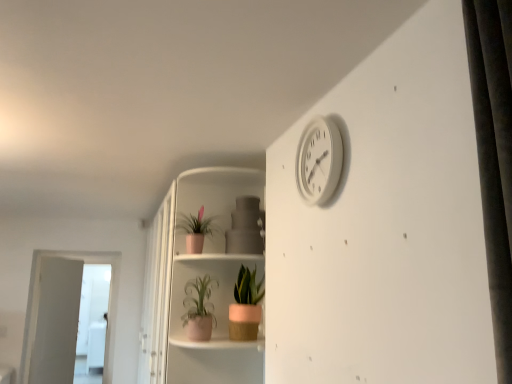
What do you see at coordinates (92, 323) in the screenshot? The image size is (512, 384). I see `white glossy screen door at lower left, the second screen door positioned from the front` at bounding box center [92, 323].

The height and width of the screenshot is (384, 512). What do you see at coordinates (39, 308) in the screenshot?
I see `white glossy screen door at left, the second screen door when ordered from back to front` at bounding box center [39, 308].

The height and width of the screenshot is (384, 512). What do you see at coordinates (246, 306) in the screenshot?
I see `pink matte pot at lower center, placed as the third houseplant when sorted from left to right` at bounding box center [246, 306].

The height and width of the screenshot is (384, 512). I want to click on matte white shelf at center, so click(x=212, y=241).

You are a GUI agent. You are given a task and a screenshot of the screen. Output one action in this format:
    pyautogui.click(x=<x>, y=<y>)
    Task: Click on the white glossy screen door at lower left, the first screen door from the left
    
    Given the screenshot: What is the action you would take?
    pyautogui.click(x=92, y=323)

From a real-world perspective, which is physically above, pink matte pot at upper center, which is the 3th houseplant in right-to-left order, or white glossy screen door at lower left, the second screen door positioned from the front?

In real-world perspective, pink matte pot at upper center, which is the 3th houseplant in right-to-left order, is above.

Consider the image. Is pink matte pot at upper center, which is the 3th houseplant in right-to-left order, bigger than white glossy screen door at lower left, the second screen door positioned from the front?

No.

Which of these two, pink matte pot at upper center, acting as the 1th houseplant starting from the left, or white glossy screen door at lower left, the second screen door positioned from the front, is thinner?

white glossy screen door at lower left, the second screen door positioned from the front, is thinner.

Is pink matte pot at upper center, which is the 3th houseplant in right-to-left order, facing towards white glossy screen door at lower left, the first screen door from the left?

No, pink matte pot at upper center, which is the 3th houseplant in right-to-left order, is not aimed at white glossy screen door at lower left, the first screen door from the left.

Is white glossy screen door at lower left, the second screen door positioned from the front, bigger than pink matte pot at lower center, positioned as the first houseplant in right-to-left order?

Indeed, white glossy screen door at lower left, the second screen door positioned from the front, has a larger size compared to pink matte pot at lower center, positioned as the first houseplant in right-to-left order.

From a real-world perspective, is white glossy screen door at lower left, placed as the 2th screen door when sorted from right to left, located higher than pink matte pot at lower center, placed as the third houseplant when sorted from left to right?

No, from a real-world perspective, white glossy screen door at lower left, placed as the 2th screen door when sorted from right to left, is not on top of pink matte pot at lower center, placed as the third houseplant when sorted from left to right.

Does white glossy screen door at lower left, positioned as the first screen door in back-to-front order, appear on the right side of pink matte pot at lower center, positioned as the first houseplant in right-to-left order?

No, white glossy screen door at lower left, positioned as the first screen door in back-to-front order, is not to the right of pink matte pot at lower center, positioned as the first houseplant in right-to-left order.

Is white glossy screen door at lower left, positioned as the first screen door in back-to-front order, turned away from pink matte pot at lower center, placed as the third houseplant when sorted from left to right?

No, white glossy screen door at lower left, positioned as the first screen door in back-to-front order,'s orientation is not away from pink matte pot at lower center, placed as the third houseplant when sorted from left to right.

Considering the sizes of objects matte white shelf at center and pink matte pot at lower center, placed as the third houseplant when sorted from left to right, in the image provided, who is smaller, matte white shelf at center or pink matte pot at lower center, placed as the third houseplant when sorted from left to right,?

pink matte pot at lower center, placed as the third houseplant when sorted from left to right, is smaller.

Is matte white shelf at center in front of pink matte pot at lower center, placed as the third houseplant when sorted from left to right?

Yes, matte white shelf at center is closer to the viewer.

Find the location of a particular element. Image resolution: width=512 pixels, height=384 pixels. shelf located above the pink matte pot at lower center, positioned as the first houseplant in right-to-left order (from the image's perspective) is located at coordinates (212, 241).

Which point is more forward, (24, 372) or (238, 317)?

The point (238, 317) is closer to the camera.

Is white glossy screen door at left, the second screen door when ordered from back to front, in front of or behind pink matte pot at lower center, positioned as the first houseplant in right-to-left order, in the image?

Visually, white glossy screen door at left, the second screen door when ordered from back to front, is located behind pink matte pot at lower center, positioned as the first houseplant in right-to-left order.

Is white glossy screen door at left, the second screen door when ordered from back to front, aimed at pink matte pot at lower center, positioned as the first houseplant in right-to-left order?

No, white glossy screen door at left, the second screen door when ordered from back to front, is not aimed at pink matte pot at lower center, positioned as the first houseplant in right-to-left order.

Who is taller, white glossy screen door at left, which is counted as the 1th screen door, starting from the right, or pink matte pot at lower center, positioned as the first houseplant in right-to-left order?

With more height is white glossy screen door at left, which is counted as the 1th screen door, starting from the right.

Considering the points (242, 315) and (226, 195), which point is in front, point (242, 315) or point (226, 195)?

The point (242, 315) is closer to the camera.

From a real-world perspective, is pink matte pot at lower center, positioned as the first houseplant in right-to-left order, positioned under matte white shelf at center based on gravity?

Yes, from a real-world perspective, pink matte pot at lower center, positioned as the first houseplant in right-to-left order, is beneath matte white shelf at center.

Measure the distance between pink matte pot at lower center, positioned as the first houseplant in right-to-left order, and matte white shelf at center.

pink matte pot at lower center, positioned as the first houseplant in right-to-left order, is 25.04 centimeters away from matte white shelf at center.

From the image's perspective, is white glossy screen door at lower left, the first screen door from the left, located above pink matte pot at upper center, which is the 3th houseplant in right-to-left order?

Actually, white glossy screen door at lower left, the first screen door from the left, appears below pink matte pot at upper center, which is the 3th houseplant in right-to-left order, in the image.

Considering the positions of point (99, 382) and point (189, 216), is point (99, 382) closer or farther from the camera than point (189, 216)?

Point (99, 382) appears to be farther away from the viewer than point (189, 216).

Can you tell me how much white glossy screen door at lower left, placed as the 2th screen door when sorted from right to left, and pink matte pot at upper center, which is the 3th houseplant in right-to-left order, differ in facing direction?

They differ by 67.4 degrees in their facing directions.

Who is taller, white glossy screen door at lower left, the second screen door positioned from the front, or pink matte pot at upper center, which is the 3th houseplant in right-to-left order?

With more height is white glossy screen door at lower left, the second screen door positioned from the front.

In the scene shown: Between white plastic clock at upper right and pink matte pot at lower center, positioned as the first houseplant in right-to-left order, which one has larger size?

Bigger between the two is pink matte pot at lower center, positioned as the first houseplant in right-to-left order.

Which is farther from the camera, (x=318, y=167) or (x=247, y=281)?

The point (x=247, y=281) is farther from the camera.

From the image's perspective, which one is positioned higher, white plastic clock at upper right or pink matte pot at lower center, placed as the third houseplant when sorted from left to right?

From the image's view, white plastic clock at upper right is above.

Is white plastic clock at upper right in front of or behind pink matte pot at lower center, placed as the third houseplant when sorted from left to right, in the image?

Clearly, white plastic clock at upper right is in front of pink matte pot at lower center, placed as the third houseplant when sorted from left to right.

Locate an element on the screen. This screenshot has height=384, width=512. the 2nd screen door directly beneath the pink matte pot at upper center, acting as the 1th houseplant starting from the left (from a real-world perspective) is located at coordinates (92, 323).

Image resolution: width=512 pixels, height=384 pixels. There is a pink matte pot at lower center, positioned as the first houseplant in right-to-left order. In order to click on the 2nd screen door below it (from the image's perspective) in this screenshot , I will do `click(92, 323)`.

From the image, which object appears to be nearer to white glossy screen door at left, the second screen door when ordered from back to front, white glossy screen door at lower left, the first screen door from the left, or pink matte pot at lower center, positioned as the first houseplant in right-to-left order?

white glossy screen door at lower left, the first screen door from the left, is closer to white glossy screen door at left, the second screen door when ordered from back to front.

From the image, which object appears to be farther from white glossy screen door at lower left, placed as the 2th screen door when sorted from right to left, matte white shelf at center or white glossy screen door at left, the second screen door when ordered from back to front?

matte white shelf at center lies further to white glossy screen door at lower left, placed as the 2th screen door when sorted from right to left, than the other object.

Looking at the image, which one is located further to pink matte pot at upper center, acting as the 1th houseplant starting from the left, white plastic clock at upper right or white glossy screen door at lower left, the second screen door positioned from the front?

white glossy screen door at lower left, the second screen door positioned from the front, is positioned further to the anchor pink matte pot at upper center, acting as the 1th houseplant starting from the left.

In the scene shown: From the image, which object appears to be farther from matte white shelf at center, pink matte pot at lower center, positioned as the first houseplant in right-to-left order, or white glossy screen door at lower left, the second screen door positioned from the front?

white glossy screen door at lower left, the second screen door positioned from the front, is further to matte white shelf at center.

From the image, which object appears to be nearer to white plastic clock at upper right, white glossy screen door at lower left, the second screen door positioned from the front, or matte white shelf at center?

The object closer to white plastic clock at upper right is matte white shelf at center.

Estimate the real-world distances between objects in this image. Which object is further from matte white shelf at center, pink matte pot at upper center, which is the 3th houseplant in right-to-left order, or pink matte pot at lower center, positioned as the first houseplant in right-to-left order?

pink matte pot at lower center, positioned as the first houseplant in right-to-left order, is positioned further to the anchor matte white shelf at center.

Which object lies nearer to the anchor point pink matte pot at upper center, acting as the 1th houseplant starting from the left, white glossy screen door at lower left, placed as the 2th screen door when sorted from right to left, or white plastic clock at upper right?

The object closer to pink matte pot at upper center, acting as the 1th houseplant starting from the left, is white plastic clock at upper right.

When comparing their distances from pink matte pot at upper center, which is the 3th houseplant in right-to-left order, does white glossy screen door at left, placed as the 1th screen door when sorted from front to back, or white glossy screen door at lower left, the second screen door positioned from the front, seem further?

white glossy screen door at lower left, the second screen door positioned from the front.

The image size is (512, 384). Find the location of `screen door between pink matte pot at upper center, which is the 3th houseplant in right-to-left order, and white glossy screen door at lower left, placed as the 2th screen door when sorted from right to left, in the front-back direction`. screen door between pink matte pot at upper center, which is the 3th houseplant in right-to-left order, and white glossy screen door at lower left, placed as the 2th screen door when sorted from right to left, in the front-back direction is located at coordinates click(x=39, y=308).

Locate an element on the screen. This screenshot has width=512, height=384. houseplant between white plastic clock at upper right and pink matte pot at lower center, positioned as the first houseplant in right-to-left order, along the z-axis is located at coordinates (199, 308).

Locate an element on the screen. shelf located between white plastic clock at upper right and white glossy screen door at left, placed as the 1th screen door when sorted from front to back, in the depth direction is located at coordinates (212, 241).

In order to click on shelf between pink matte pot at upper center, acting as the 1th houseplant starting from the left, and matte pink pot at lower center, acting as the 2th houseplant starting from the right, from top to bottom in this screenshot , I will do `click(212, 241)`.